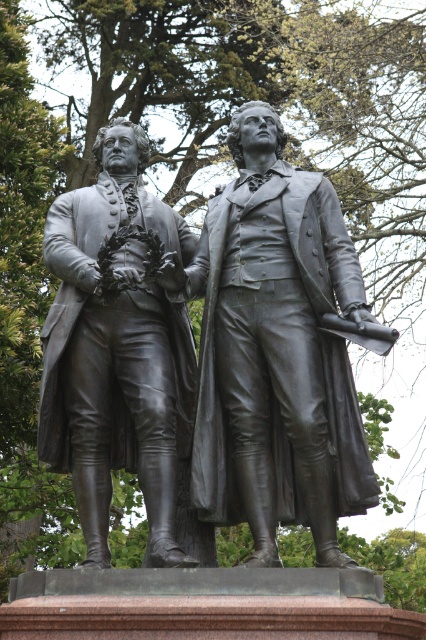
Question: Can you confirm if bronze statue at center is positioned to the right of bronze statue at left?

Choices:
 (A) no
 (B) yes

Answer: (B)

Question: Is the position of bronze statue at center less distant than that of bronze statue at left?

Choices:
 (A) yes
 (B) no

Answer: (A)

Question: Among these points, which one is nearest to the camera?

Choices:
 (A) (123, 460)
 (B) (199, 250)

Answer: (A)

Question: Is bronze statue at center closer to camera compared to bronze statue at left?

Choices:
 (A) yes
 (B) no

Answer: (A)